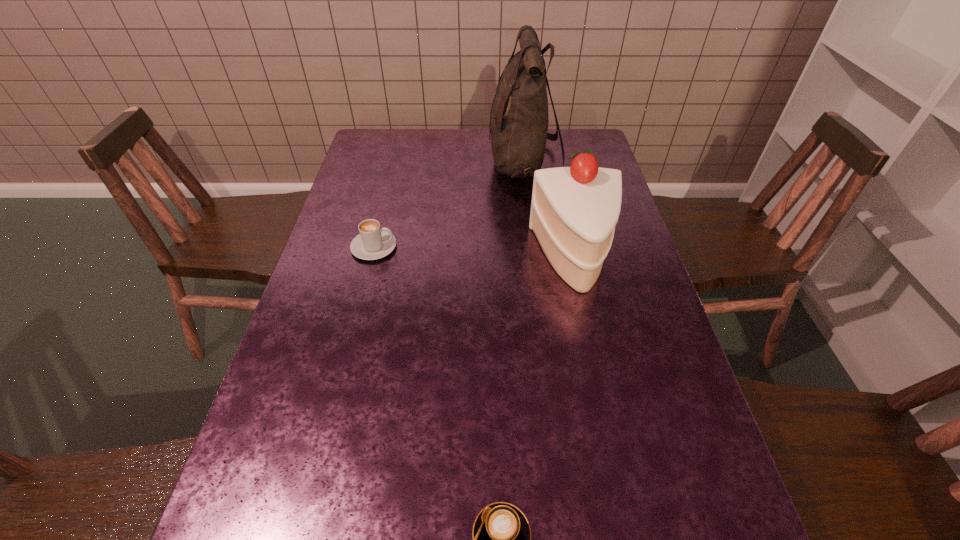
Identify the location of object that is at the far edge. Image resolution: width=960 pixels, height=540 pixels. (519, 121).

Find the location of a particular element. The height and width of the screenshot is (540, 960). object that is at the left edge is located at coordinates (373, 242).

Where is `backpack that is at the right edge`? This screenshot has height=540, width=960. backpack that is at the right edge is located at coordinates (519, 121).

Identify the location of cake positioned at the right edge. (574, 210).

You are a GUI agent. You are given a task and a screenshot of the screen. Output one action in this format:
    pyautogui.click(x=<x>, y=<y>)
    Task: Click on the object positioned at the far right corner
    The width and height of the screenshot is (960, 540).
    Given the screenshot: What is the action you would take?
    pyautogui.click(x=519, y=121)

Find the location of a particular element. free region at the left edge of the desktop is located at coordinates (355, 222).

Find the location of a particular element. free space at the right edge of the desktop is located at coordinates coord(625,226).

Locate an element on the screen. The image size is (960, 540). vacant position at the far left corner of the desktop is located at coordinates (384, 158).

Locate an element on the screen. vacant space that's between the cake and the second shortest object is located at coordinates (474, 253).

Identify the location of free space between the third tallest object and the tallest object. (449, 206).